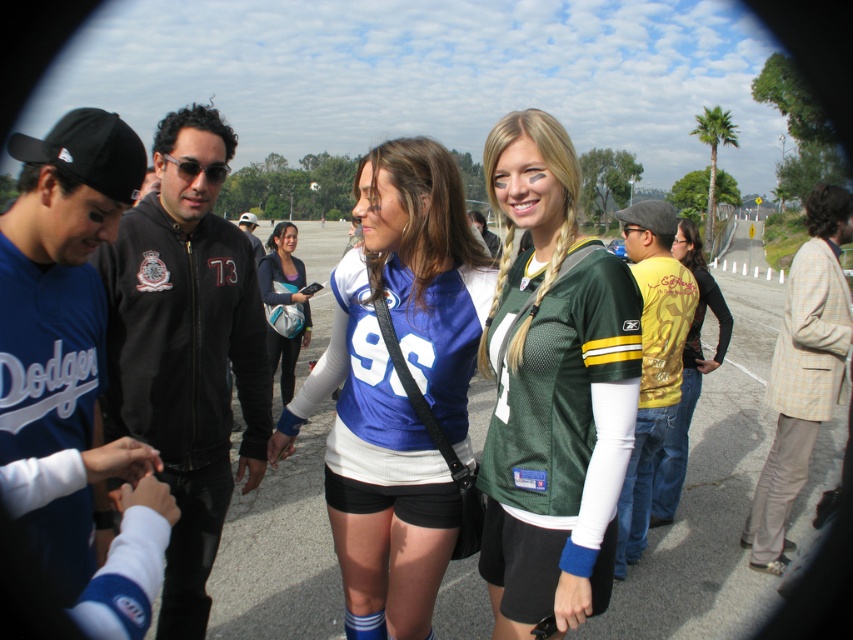
Question: Can you confirm if blue jersey at left is positioned above blue jersey at center?

Choices:
 (A) yes
 (B) no

Answer: (B)

Question: Which object appears closest to the camera in this image?

Choices:
 (A) blue jersey at center
 (B) dark brown leather jacket at center
 (C) yellow printed t-shirt at right

Answer: (B)

Question: Estimate the real-world distances between objects in this image. Which object is closer to the white jersey at center?

Choices:
 (A) blue jersey at center
 (B) green jersey at right
 (C) matte jersey at center
 (D) metallic gold shirt at right

Answer: (C)

Question: From the image, what is the correct spatial relationship of green jersey at right in relation to dark brown leather jacket at center?

Choices:
 (A) right
 (B) left

Answer: (A)

Question: Which point is closer to the camera?

Choices:
 (A) white jersey at center
 (B) yellow printed t-shirt at right

Answer: (A)

Question: Is green jersey at center positioned at the back of dark brown leather jacket at center?

Choices:
 (A) no
 (B) yes

Answer: (A)